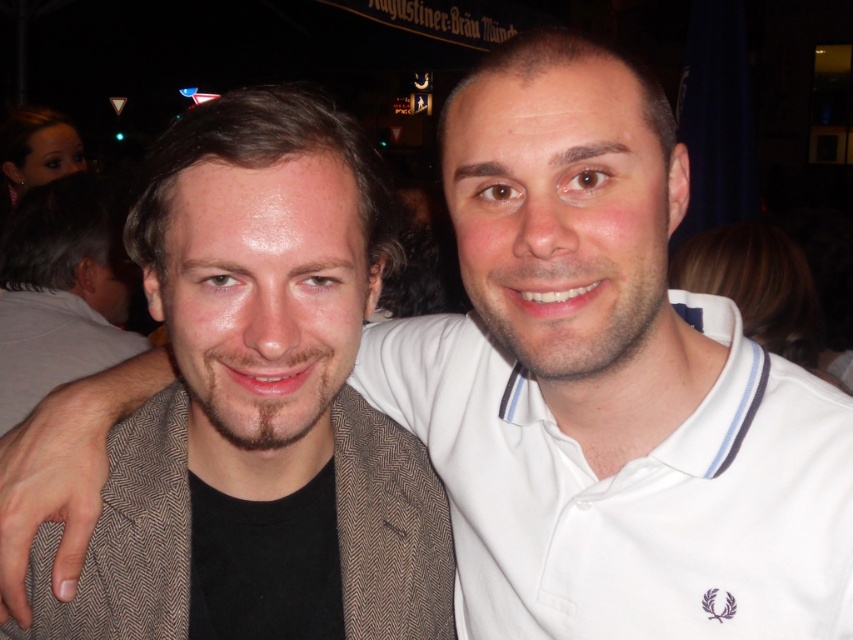
You are a photographer trying to capture a group photo. The two subjects are wearing a brown herringbone blazer at left and a white cotton polo shirt at center. The minimum distance required between subjects for your camera to focus properly is 20 centimeters. Can these two subjects stand closer together without affecting the focus?

The brown herringbone blazer at left and white cotton polo shirt at center are 21.56 centimeters apart, which is more than the minimum required 20 centimeters. Therefore, they can move closer by up to 1.56 centimeters without affecting the focus.

You are a photographer trying to adjust the framing of the image to focus on the brown herringbone blazer at left. What coordinates should you center your camera on to ensure the blazer is in the center of the frame?

The brown herringbone blazer at left is positioned at coordinates point (x=262, y=396), so you should center your camera at those coordinates to focus on it.

You are a photographer trying to adjust the focus of your camera. You want to ensure both the brown herringbone blazer at left and the white cotton polo shirt at center are in sharp focus. Based on their positions, which one should you focus on to maximize clarity for both?

You should focus on the brown herringbone blazer at left because it is closer to the viewer, and focusing on the closer object will keep both in focus due to the depth of field.